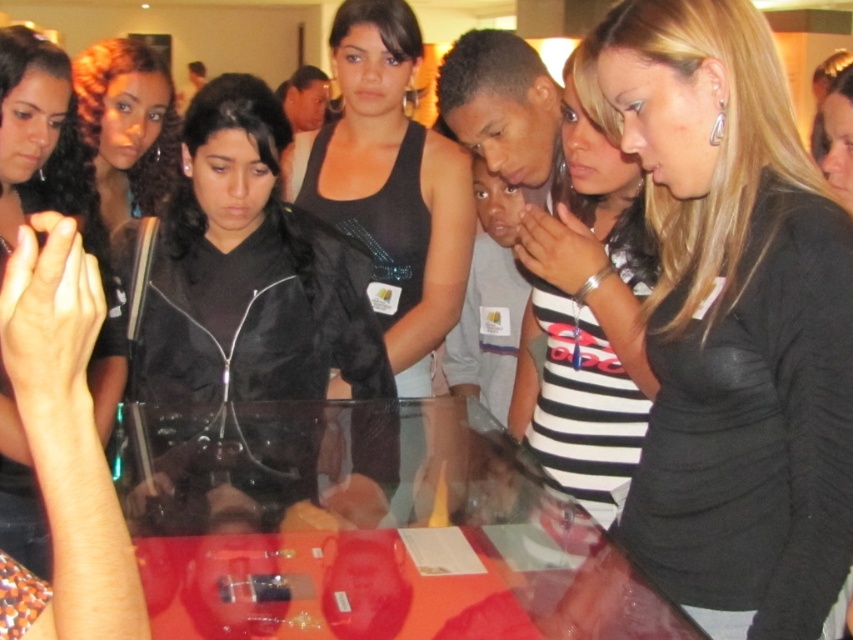
Is transparent glass table at center to the right of matte black jacket at upper left from the viewer's perspective?

Yes, transparent glass table at center is to the right of matte black jacket at upper left.

Is point (160, 636) closer to viewer compared to point (47, 129)?

Yes, it is in front of point (47, 129).

At what (x,y) coordinates should I click in order to perform the action: click on transparent glass table at center. Please return your answer as a coordinate pair (x, y). Looking at the image, I should click on pyautogui.click(x=366, y=529).

Who is positioned more to the right, black matte shirt at center or black sequined tank top at center?

black matte shirt at center is more to the right.

From the picture: Is black matte shirt at center closer to the viewer compared to black sequined tank top at center?

Yes, it is.

Is point (821, 333) closer to camera compared to point (372, 125)?

Yes, point (821, 333) is closer to viewer.

Image resolution: width=853 pixels, height=640 pixels. What are the coordinates of `black matte shirt at center` in the screenshot? It's located at (733, 321).

Does black leather jacket at center appear on the left side of striped jersey at center?

Indeed, black leather jacket at center is positioned on the left side of striped jersey at center.

Who is higher up, black leather jacket at center or striped jersey at center?

Positioned higher is black leather jacket at center.

Who is more forward, (218,314) or (578,420)?

Positioned in front is point (578,420).

Find the location of a particular element. black leather jacket at center is located at coordinates (244, 273).